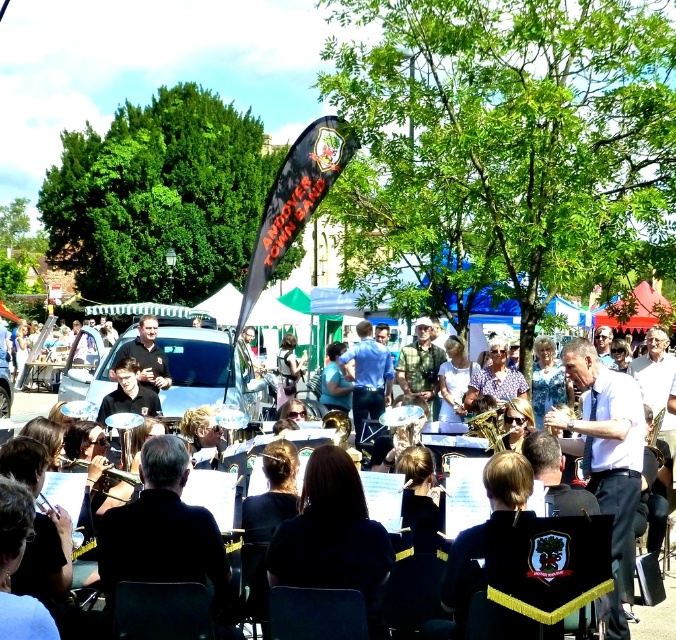
You are a photographer trying to capture a photo of the blue shirt at center and the black uniform at center. Which one should you focus on first if you want to ensure both are in the frame without moving the camera?

The blue shirt at center should be focused on first because it is shorter than the black uniform at center, so adjusting the focus starting from the shorter one ensures both are in frame.

You are a photographer positioned at the edge of the band setup. You want to capture a photo that includes both the musicians with their yellow tasselled music stands and the conductor in the midground. Based on their positions, will the white shirt at center be visible in the background of your photo?

The white shirt at center is located at point (604,451), which places it in the background of the image. Since the question asks if it will be visible in the background, the answer is yes, it will be visible.